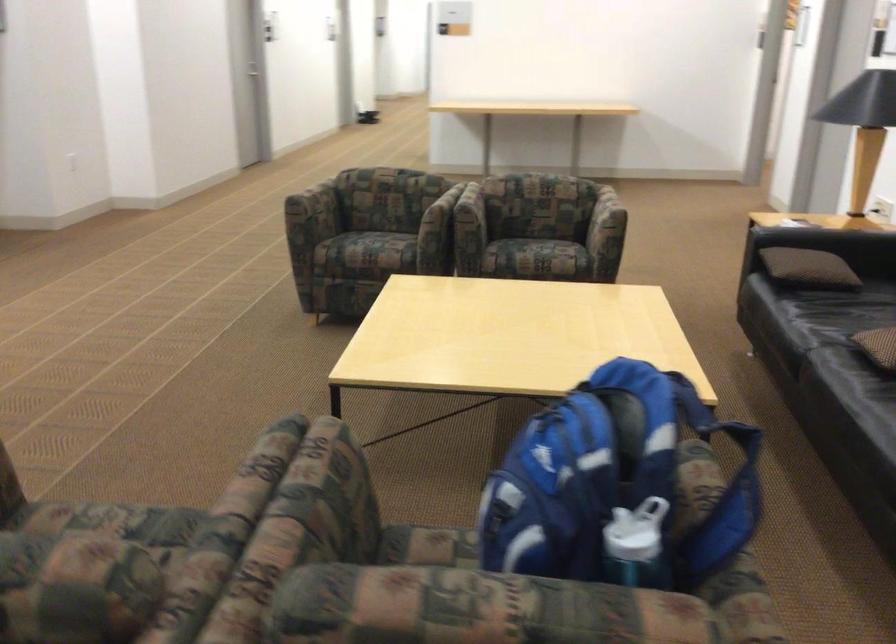
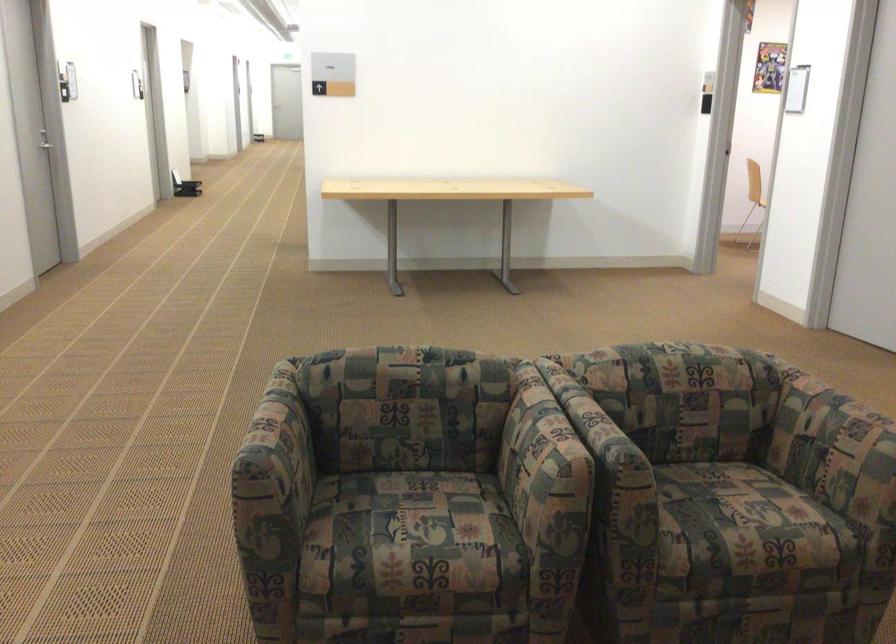
Where in the second image is the point corresponding to the point at 520,234 from the first image?

(707, 505)